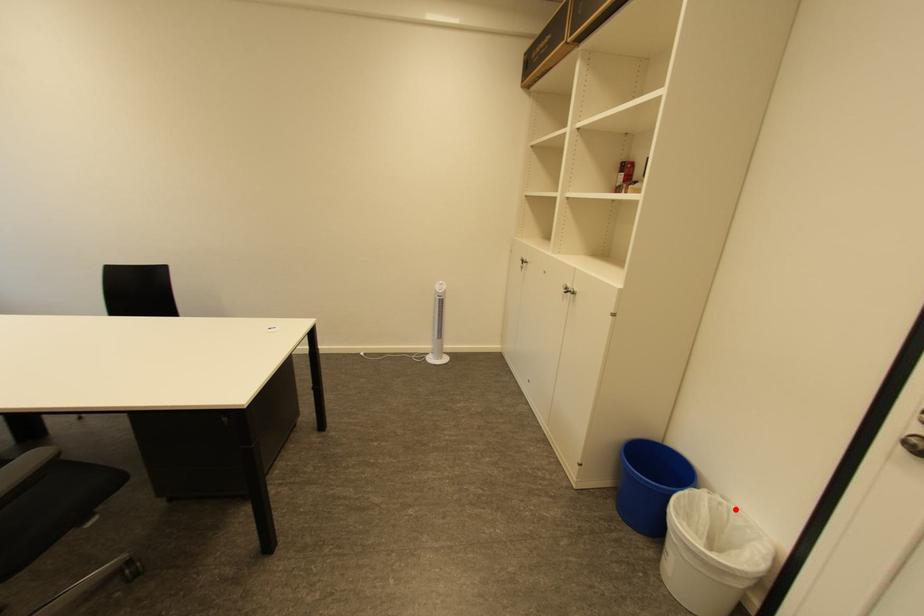
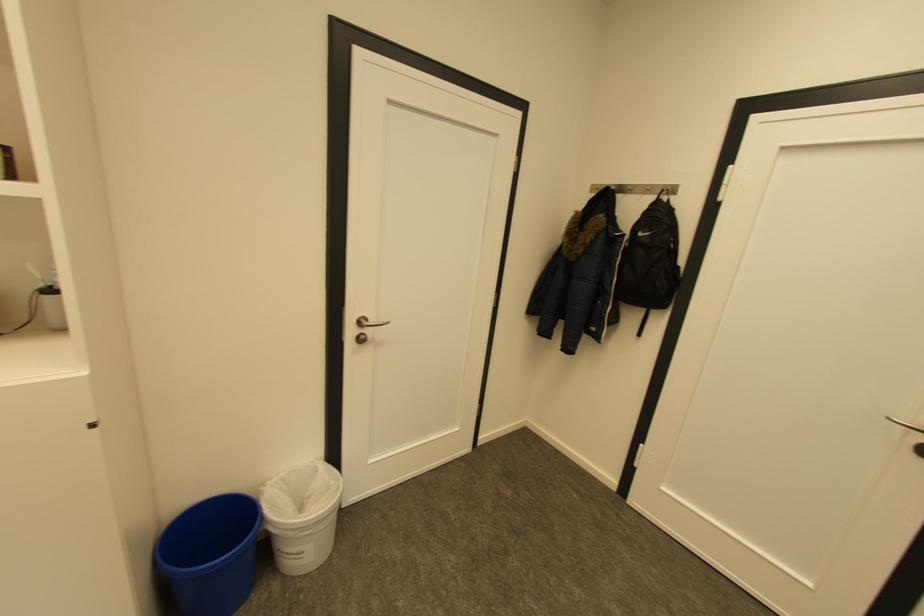
Where in the second image is the point corresponding to the highlighted location from the first image?

(289, 477)